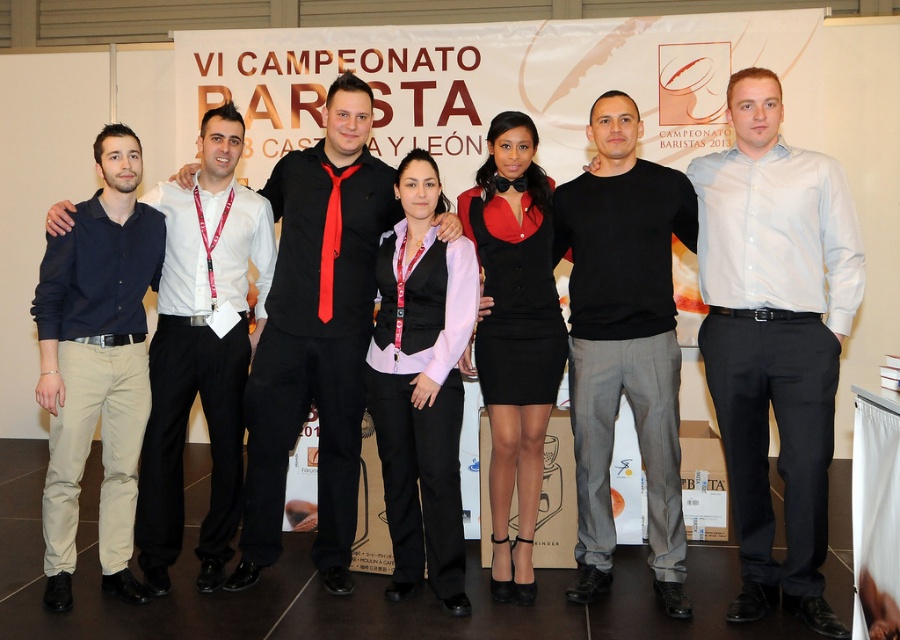
Question: Is black matte sweater at center smaller than dark blue shirt at left?

Choices:
 (A) yes
 (B) no

Answer: (B)

Question: Considering the real-world distances, which object is closest to the matte black vest at center?

Choices:
 (A) black matte sweater at center
 (B) matte black dress at center
 (C) black matte shirt at center

Answer: (B)

Question: Estimate the real-world distances between objects in this image. Which object is closer to the red satin tie at center?

Choices:
 (A) black matte sweater at center
 (B) navy blue shirt at left
 (C) dark blue shirt at left
 (D) light blue shirt at center

Answer: (C)

Question: Can you confirm if matte black vest at center is positioned to the left of matte black dress at center?

Choices:
 (A) yes
 (B) no

Answer: (A)

Question: Which object is closer to the camera taking this photo?

Choices:
 (A) red satin tie at center
 (B) black matte shirt at center
 (C) matte black dress at center
 (D) black matte sweater at center

Answer: (D)

Question: Considering the relative positions of black matte shirt at center and dark blue shirt at left in the image provided, where is black matte shirt at center located with respect to dark blue shirt at left?

Choices:
 (A) above
 (B) below

Answer: (A)